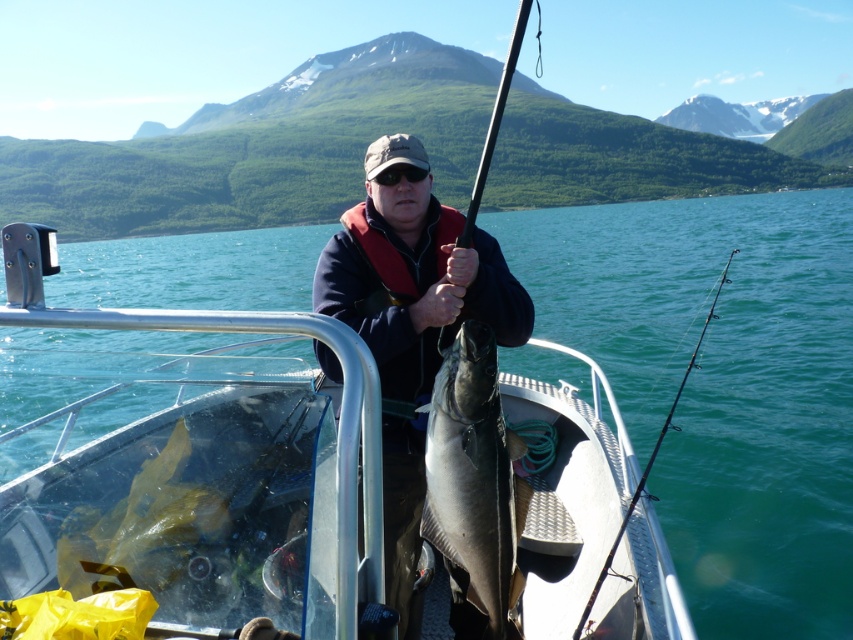
Which is above, matte black jacket at center or shiny silver fish at center?

matte black jacket at center is above.

Does matte black jacket at center have a greater height compared to shiny silver fish at center?

Indeed, matte black jacket at center has a greater height compared to shiny silver fish at center.

Locate an element on the screen. The height and width of the screenshot is (640, 853). matte black jacket at center is located at coordinates (410, 317).

At what (x,y) coordinates should I click in order to perform the action: click on matte black jacket at center. Please return your answer as a coordinate pair (x, y). The width and height of the screenshot is (853, 640). Looking at the image, I should click on (410, 317).

Can you confirm if smooth black rod at center is smaller than black rod at right?

Actually, smooth black rod at center might be larger than black rod at right.

Between smooth black rod at center and black rod at right, which one is positioned higher?

smooth black rod at center is higher up.

Does point (480, 193) lie in front of point (724, 275)?

Yes, it is.

In order to click on smooth black rod at center in this screenshot , I will do `click(494, 122)`.

Can you confirm if matte black jacket at center is positioned to the left of smooth black rod at center?

Indeed, matte black jacket at center is positioned on the left side of smooth black rod at center.

Does matte black jacket at center appear under smooth black rod at center?

Indeed, matte black jacket at center is positioned under smooth black rod at center.

Identify the location of matte black jacket at center. (410, 317).

Identify the location of matte black jacket at center. This screenshot has width=853, height=640. (410, 317).